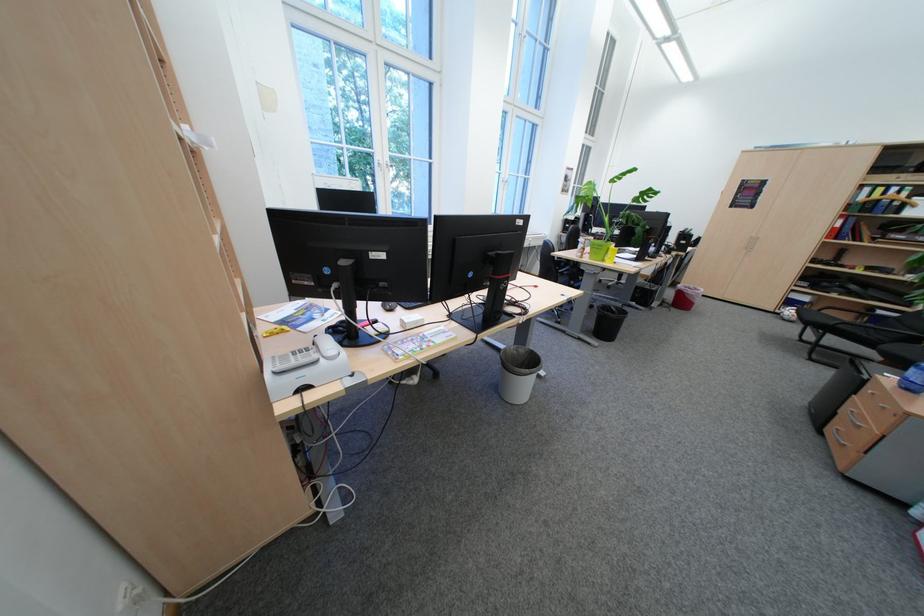
Identify the location of blue binder. (886, 199).